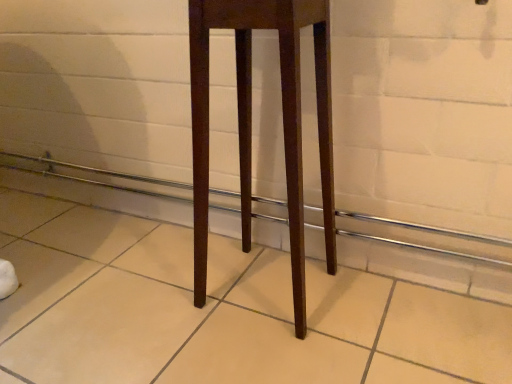
Where is `free space above brown wooden balustrade at center (from a real-world perspective)`? Image resolution: width=512 pixels, height=384 pixels. free space above brown wooden balustrade at center (from a real-world perspective) is located at coordinates (184, 144).